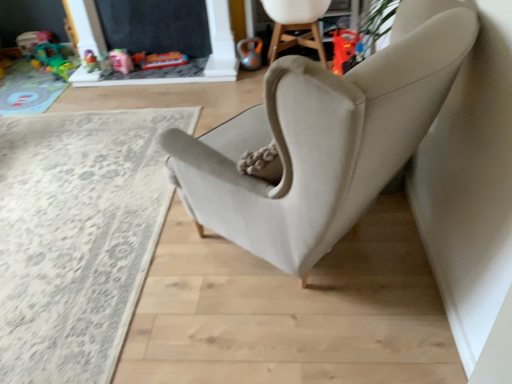
Find the location of `empty space that is ontop of beige carpet at lower left (from a real-world perspective)`. empty space that is ontop of beige carpet at lower left (from a real-world perspective) is located at coordinates (66, 192).